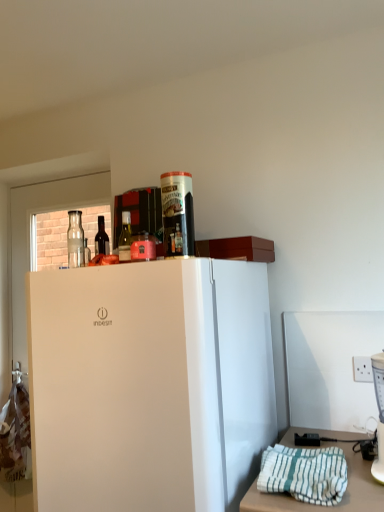
Question: Is matte glass bottle at upper center, the second bottle positioned from the back, bigger than white striped towel at lower right?

Choices:
 (A) no
 (B) yes

Answer: (A)

Question: From a real-world perspective, does matte glass bottle at upper center, arranged as the first bottle when viewed from the right, sit lower than white striped towel at lower right?

Choices:
 (A) no
 (B) yes

Answer: (A)

Question: Does matte glass bottle at upper center, marked as the 1th bottle in a front-to-back arrangement, appear on the left side of white striped towel at lower right?

Choices:
 (A) yes
 (B) no

Answer: (A)

Question: Can you confirm if matte glass bottle at upper center, marked as the 1th bottle in a front-to-back arrangement, is thinner than white striped towel at lower right?

Choices:
 (A) yes
 (B) no

Answer: (A)

Question: Does matte glass bottle at upper center, the second bottle positioned from the back, appear on the right side of white striped towel at lower right?

Choices:
 (A) yes
 (B) no

Answer: (B)

Question: Is point tap(377, 374) closer or farther from the camera than point tap(120, 252)?

Choices:
 (A) farther
 (B) closer

Answer: (A)

Question: In terms of width, does white plastic blender at right look wider or thinner when compared to matte glass bottle at upper center, which is counted as the second bottle, starting from the left?

Choices:
 (A) thin
 (B) wide

Answer: (B)

Question: From a real-world perspective, is white plastic blender at right positioned above or below matte glass bottle at upper center, the second bottle positioned from the back?

Choices:
 (A) below
 (B) above

Answer: (A)

Question: Considering their positions, is white plastic blender at right located in front of or behind matte glass bottle at upper center, which is counted as the second bottle, starting from the left?

Choices:
 (A) front
 (B) behind

Answer: (A)

Question: Does point (76, 205) appear closer or farther from the camera than point (104, 250)?

Choices:
 (A) farther
 (B) closer

Answer: (A)

Question: Considering the positions of transparent glass door at upper left and dark glass bottle at upper left, arranged as the 1th bottle when viewed from the left, in the image, is transparent glass door at upper left taller or shorter than dark glass bottle at upper left, arranged as the 1th bottle when viewed from the left,?

Choices:
 (A) short
 (B) tall

Answer: (B)

Question: Is transparent glass door at upper left situated inside dark glass bottle at upper left, arranged as the 1th bottle when viewed from the left, or outside?

Choices:
 (A) inside
 (B) outside

Answer: (B)

Question: Considering their positions, is transparent glass door at upper left located in front of or behind dark glass bottle at upper left, arranged as the 1th bottle when viewed from the left?

Choices:
 (A) front
 (B) behind

Answer: (B)

Question: Considering the positions of dark glass bottle at upper left, acting as the 1th bottle starting from the back, and white matte refrigerator at center in the image, is dark glass bottle at upper left, acting as the 1th bottle starting from the back, wider or thinner than white matte refrigerator at center?

Choices:
 (A) thin
 (B) wide

Answer: (A)

Question: From a real-world perspective, relative to white matte refrigerator at center, is dark glass bottle at upper left, acting as the 1th bottle starting from the back, vertically above or below?

Choices:
 (A) above
 (B) below

Answer: (A)